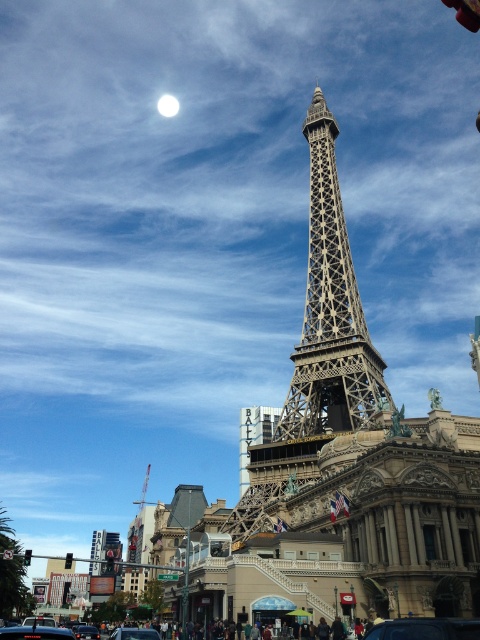
Question: Which point is farther from the camera taking this photo?

Choices:
 (A) (90, 627)
 (B) (170, 97)
 (C) (120, 634)

Answer: (B)

Question: Which point is farther to the camera?

Choices:
 (A) (78, 636)
 (B) (418, 618)

Answer: (A)

Question: Is metallic silver car at center bigger than white glossy moon at upper center?

Choices:
 (A) no
 (B) yes

Answer: (B)

Question: Can you confirm if metallic silver car at center is wider than white glossy moon at upper center?

Choices:
 (A) yes
 (B) no

Answer: (A)

Question: Which object appears closest to the camera in this image?

Choices:
 (A) metallic silver car at center
 (B) metallic structure at center
 (C) shiny black car at lower left

Answer: (C)

Question: Is metallic structure at center smaller than black glossy car at center?

Choices:
 (A) yes
 (B) no

Answer: (B)